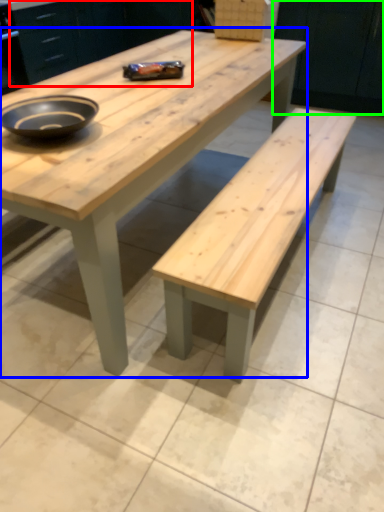
Question: Which object is the farthest from cabinetry (highlighted by a red box)? Choose among these: coffee table (highlighted by a blue box) or cabinetry (highlighted by a green box).

Choices:
 (A) coffee table
 (B) cabinetry

Answer: (A)